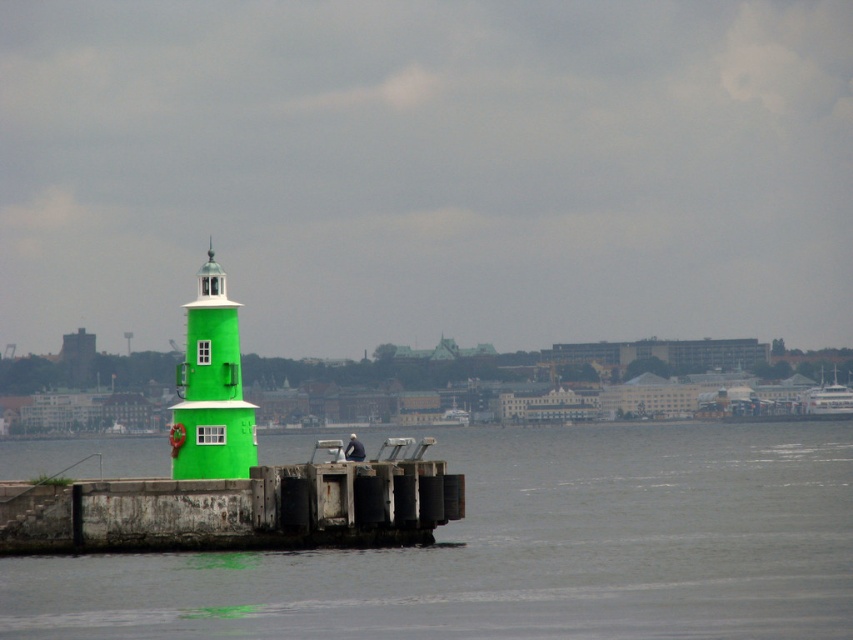
Which is above, rusty metal dock at center or green matte/lightweight tower at center?

green matte/lightweight tower at center is higher up.

The width and height of the screenshot is (853, 640). What do you see at coordinates (236, 508) in the screenshot? I see `rusty metal dock at center` at bounding box center [236, 508].

Describe the element at coordinates (236, 508) in the screenshot. I see `rusty metal dock at center` at that location.

Locate an element on the screen. The height and width of the screenshot is (640, 853). rusty metal dock at center is located at coordinates (236, 508).

Which is more to the right, green matte/lightweight tower at center or white glossy boat at upper right?

From the viewer's perspective, white glossy boat at upper right appears more on the right side.

Which is behind, point (233, 397) or point (807, 396)?

Point (807, 396)

Image resolution: width=853 pixels, height=640 pixels. In order to click on green matte/lightweight tower at center in this screenshot , I will do `click(212, 388)`.

What do you see at coordinates (520, 550) in the screenshot? I see `green concrete water at center` at bounding box center [520, 550].

Does green concrete water at center have a larger size compared to green matte/lightweight tower at center?

Yes, green concrete water at center is bigger than green matte/lightweight tower at center.

Locate an element on the screen. The width and height of the screenshot is (853, 640). green concrete water at center is located at coordinates (520, 550).